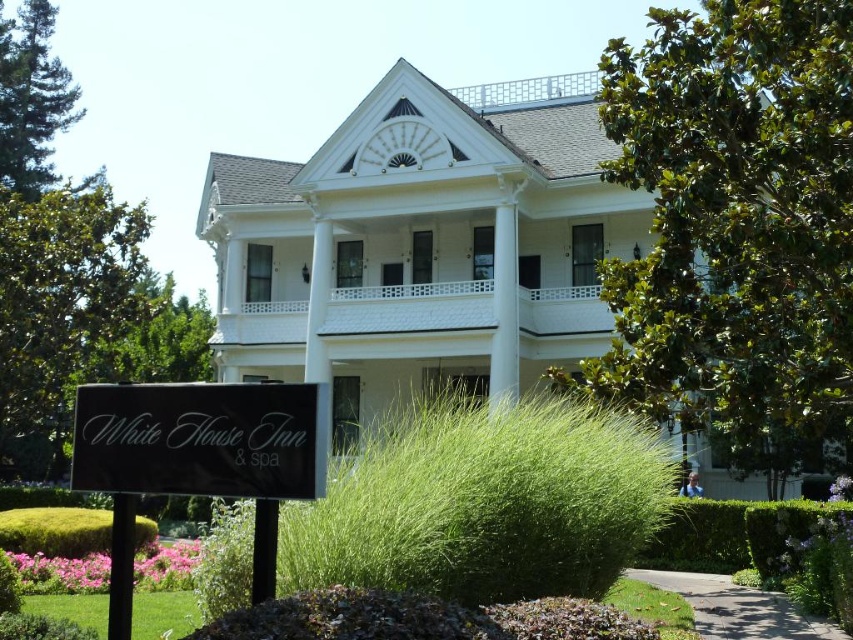
Does black matte sign at lower left appear on the right side of green mossy hedge at lower left?

Yes, black matte sign at lower left is to the right of green mossy hedge at lower left.

At what (x,y) coordinates should I click in order to perform the action: click on black matte sign at lower left. Please return your answer as a coordinate pair (x, y). This screenshot has height=640, width=853. Looking at the image, I should click on (201, 440).

This screenshot has width=853, height=640. Identify the location of black matte sign at lower left. (201, 440).

Can you confirm if green grass at lower center is taller than green mossy hedge at lower left?

Yes.

Who is shorter, green grass at lower center or green mossy hedge at lower left?

green mossy hedge at lower left is shorter.

Identify the location of green grass at lower center. Image resolution: width=853 pixels, height=640 pixels. click(x=485, y=502).

Image resolution: width=853 pixels, height=640 pixels. Find the location of `green grass at lower center`. green grass at lower center is located at coordinates (485, 502).

Does point (450, 502) come farther from viewer compared to point (248, 461)?

Yes, it is behind point (248, 461).

Describe the element at coordinates (485, 502) in the screenshot. I see `green grass at lower center` at that location.

Locate an element on the screen. The height and width of the screenshot is (640, 853). green grass at lower center is located at coordinates (485, 502).